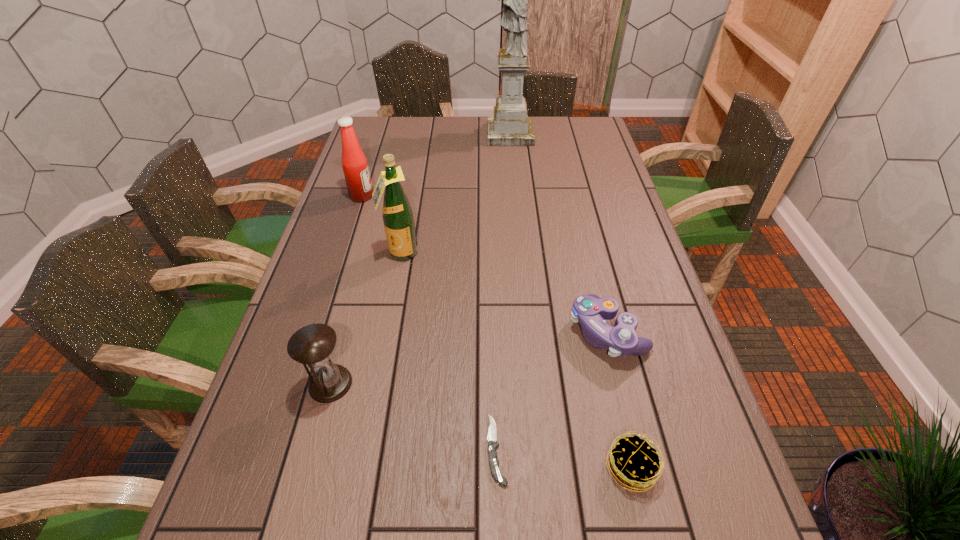
Find the location of `sculpture`. sculpture is located at coordinates (510, 126).

You are a GUI agent. You are given a task and a screenshot of the screen. Output one action in this format:
    pyautogui.click(x=<x>, y=<y>)
    Task: Click on the farthest object
    The width and height of the screenshot is (960, 540).
    Given the screenshot: What is the action you would take?
    [x=510, y=126]

Where is `the third object from left to right`? The image size is (960, 540). the third object from left to right is located at coordinates (397, 214).

Where is `liquor`? The image size is (960, 540). liquor is located at coordinates (397, 214).

I want to click on the fifth shortest object, so click(x=354, y=163).

Find the location of a particular element. condiment is located at coordinates (354, 163).

Locate an element on the screen. The width and height of the screenshot is (960, 540). the fourth shortest object is located at coordinates (313, 344).

The height and width of the screenshot is (540, 960). I want to click on control, so click(589, 311).

This screenshot has width=960, height=540. I want to click on patty, so click(x=633, y=461).

This screenshot has width=960, height=540. What are the coordinates of `the shortest object` in the screenshot? It's located at (492, 433).